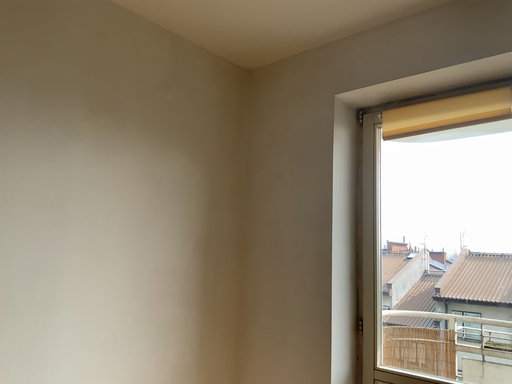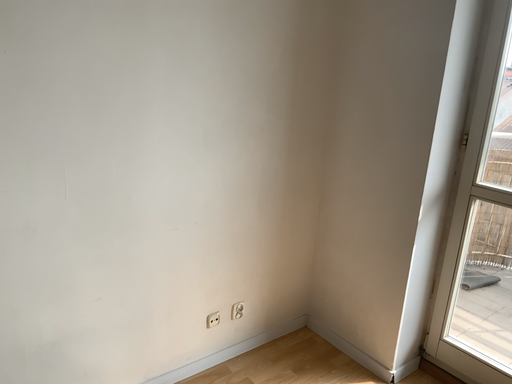
Question: How did the camera likely rotate when shooting the video?

Choices:
 (A) rotated downward
 (B) rotated upward

Answer: (A)